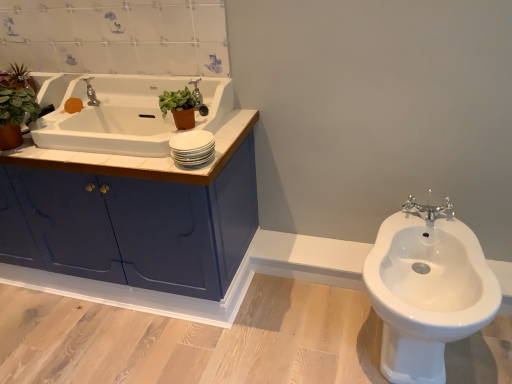
Question: Is chrome metallic tap at right, the 1th tap positioned from the right, thinner than white wood counter top at upper left?

Choices:
 (A) yes
 (B) no

Answer: (A)

Question: From a real-world perspective, is chrome metallic tap at right, the 1th tap positioned from the front, positioned under white wood counter top at upper left based on gravity?

Choices:
 (A) no
 (B) yes

Answer: (B)

Question: Considering the relative sizes of chrome metallic tap at right, the 1th tap positioned from the front, and white wood counter top at upper left in the image provided, is chrome metallic tap at right, the 1th tap positioned from the front, wider than white wood counter top at upper left?

Choices:
 (A) no
 (B) yes

Answer: (A)

Question: Would you say chrome metallic tap at right, positioned as the 2th tap in top-to-bottom order, is outside white wood counter top at upper left?

Choices:
 (A) no
 (B) yes

Answer: (B)

Question: From the image's perspective, is chrome metallic tap at right, positioned as the 2th tap in top-to-bottom order, above white wood counter top at upper left?

Choices:
 (A) no
 (B) yes

Answer: (A)

Question: Would you say blue glossy cabinet at left is inside or outside orange matte soap at upper left?

Choices:
 (A) outside
 (B) inside

Answer: (A)

Question: Based on their sizes in the image, would you say blue glossy cabinet at left is bigger or smaller than orange matte soap at upper left?

Choices:
 (A) small
 (B) big

Answer: (B)

Question: Looking at their shapes, would you say blue glossy cabinet at left is wider or thinner than orange matte soap at upper left?

Choices:
 (A) thin
 (B) wide

Answer: (B)

Question: In the image, is blue glossy cabinet at left on the left side or the right side of orange matte soap at upper left?

Choices:
 (A) right
 (B) left

Answer: (B)

Question: Does point tap(175, 173) appear closer or farther from the camera than point tap(170, 109)?

Choices:
 (A) farther
 (B) closer

Answer: (B)

Question: Is white wood counter top at upper left wider or thinner than green matte plant at upper center, the second plant when ordered from back to front?

Choices:
 (A) thin
 (B) wide

Answer: (B)

Question: Considering the positions of white wood counter top at upper left and green matte plant at upper center, the second plant when ordered from back to front, in the image, is white wood counter top at upper left bigger or smaller than green matte plant at upper center, the second plant when ordered from back to front,?

Choices:
 (A) small
 (B) big

Answer: (B)

Question: From the image's perspective, is white wood counter top at upper left above or below green matte plant at upper center, which is the 1th plant from right to left?

Choices:
 (A) below
 (B) above

Answer: (A)

Question: Choose the correct answer: Is chrome metallic tap at upper left, placed as the 1th tap when sorted from top to bottom, inside green matte plant at upper center, which is counted as the second plant, starting from the left, or outside it?

Choices:
 (A) inside
 (B) outside

Answer: (B)

Question: From a real-world perspective, is chrome metallic tap at upper left, the 2th tap when ordered from front to back, above or below green matte plant at upper center, marked as the first plant in a front-to-back arrangement?

Choices:
 (A) above
 (B) below

Answer: (A)